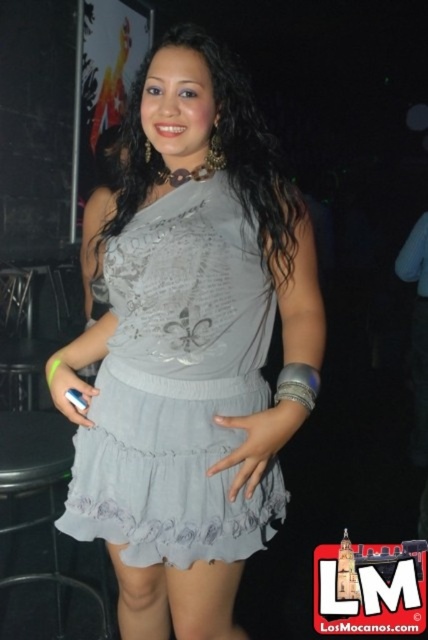
Which is behind, point (190, 298) or point (216, 417)?

Point (216, 417)

Is satin gray dress at center smaller than satin fabric hand at center?

No.

Is point (88, 520) in front of point (294, 426)?

No.

Locate an element on the screen. satin gray dress at center is located at coordinates (178, 387).

Which is in front, point (210, 467) or point (86, 360)?

Point (210, 467) is more forward.

Describe the element at coordinates (258, 442) in the screenshot. The image size is (428, 640). I see `satin fabric hand at center` at that location.

Is point (219, 465) positioned behind point (65, 387)?

No, it is in front of (65, 387).

Where is `satin fabric hand at center`? satin fabric hand at center is located at coordinates (258, 442).

Who is more distant from viewer, (64, 461) or (86, 400)?

The point (64, 461) is more distant.

Is point (35, 442) less distant than point (77, 417)?

No, it is behind (77, 417).

Find the location of `black plastic bar stool at lower left`. black plastic bar stool at lower left is located at coordinates (41, 488).